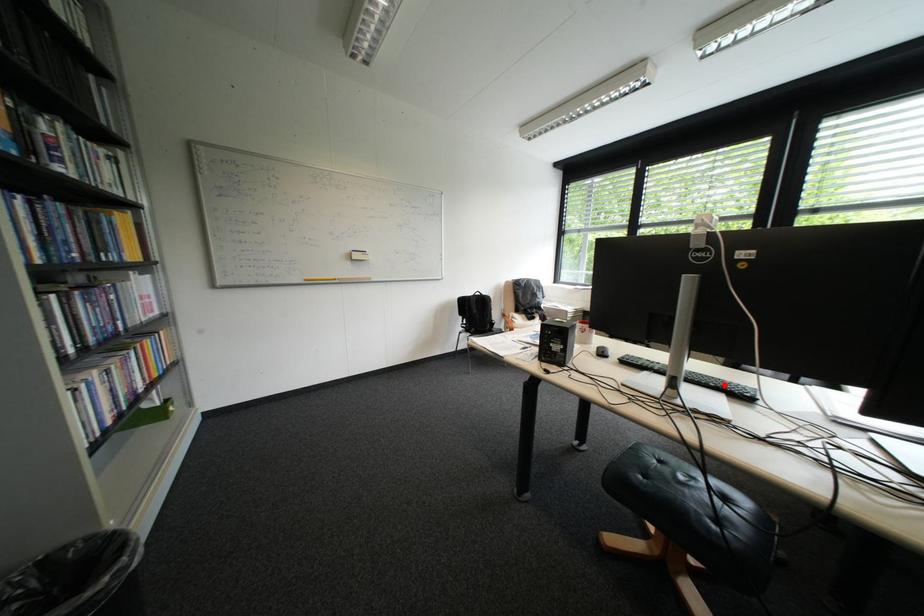
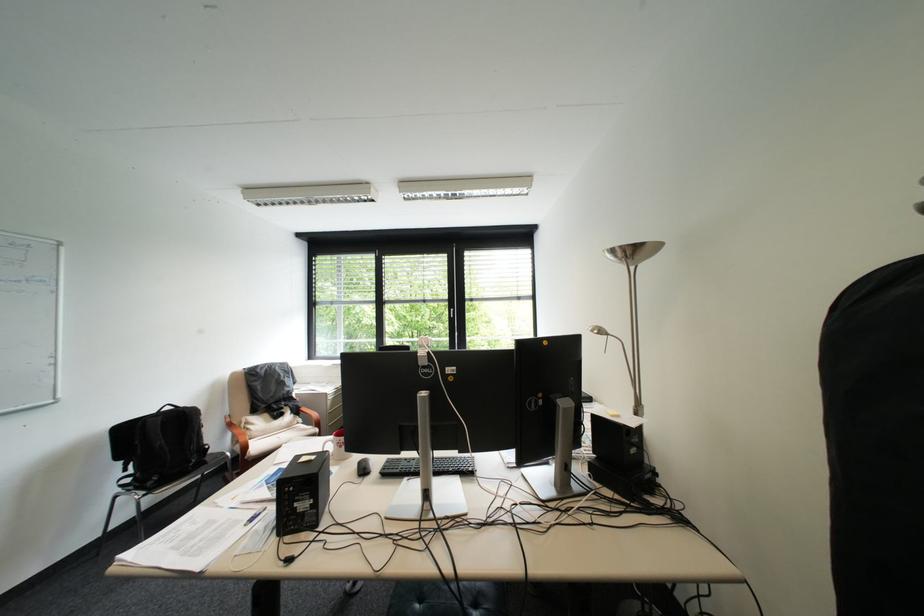
Question: I am providing you with two images of the same scene from different viewpoints. A red point is shown in image1. For the corresponding object point in image2, is it positioned nearer or farther from the camera?

Choices:
 (A) Nearer
 (B) Farther

Answer: (B)